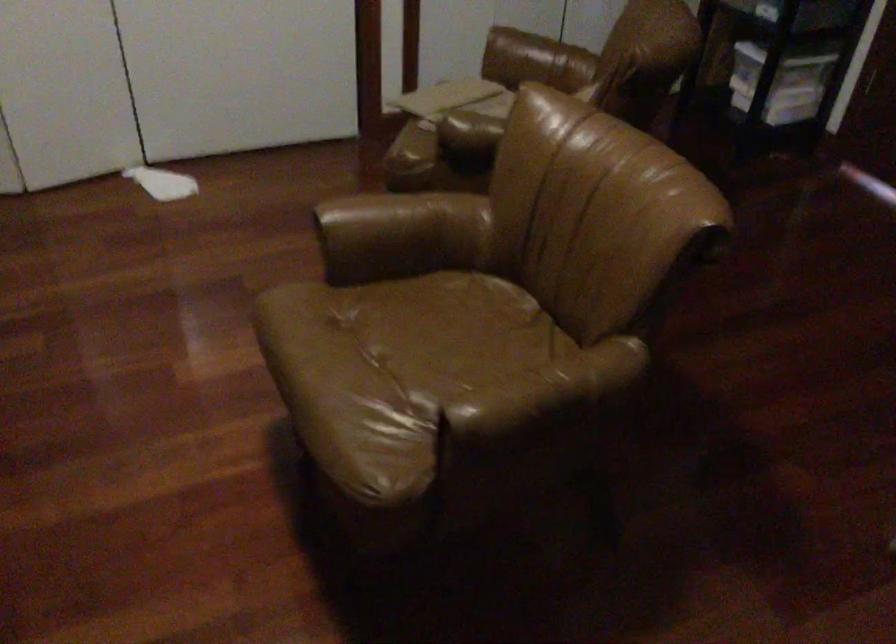
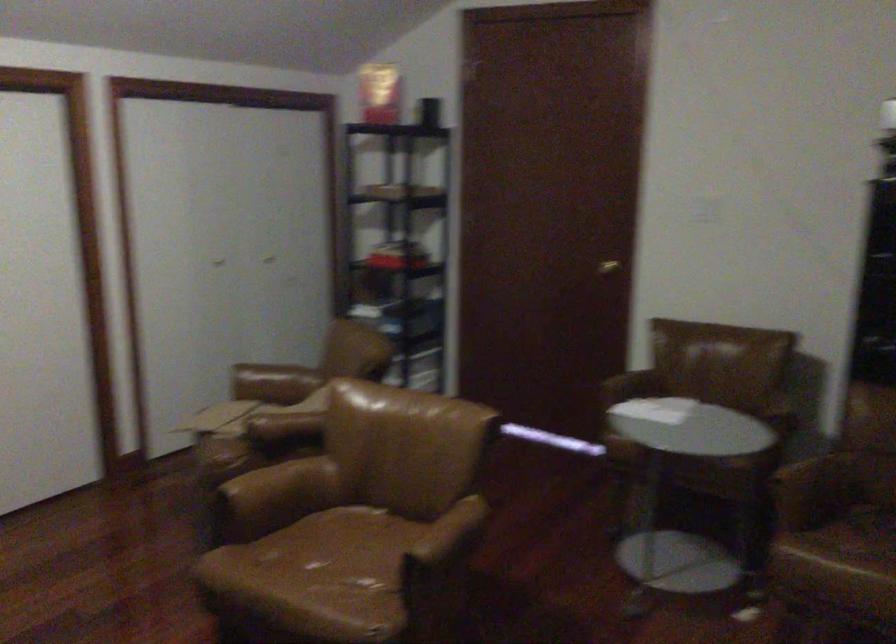
Where in the second image is the point corresponding to (488,128) from the first image?

(283, 426)